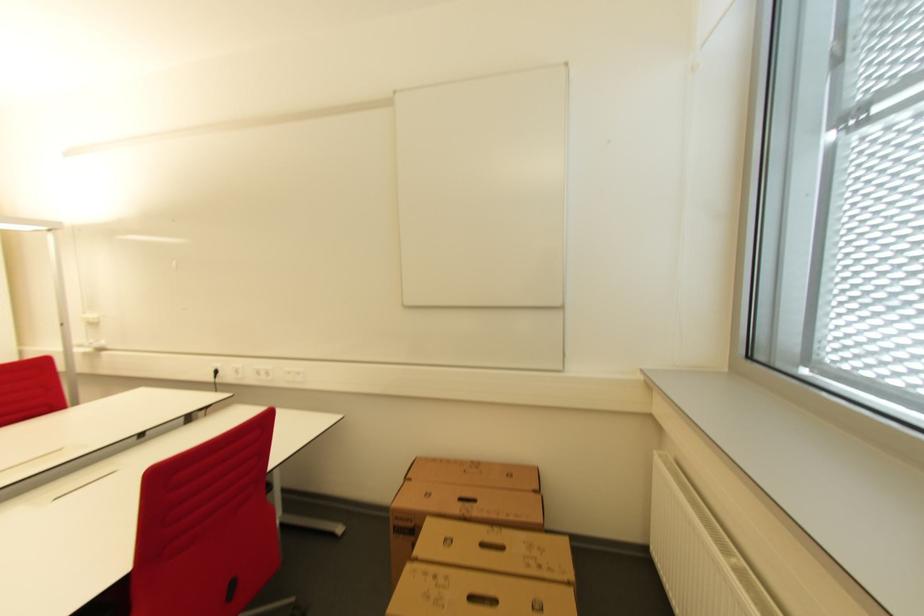
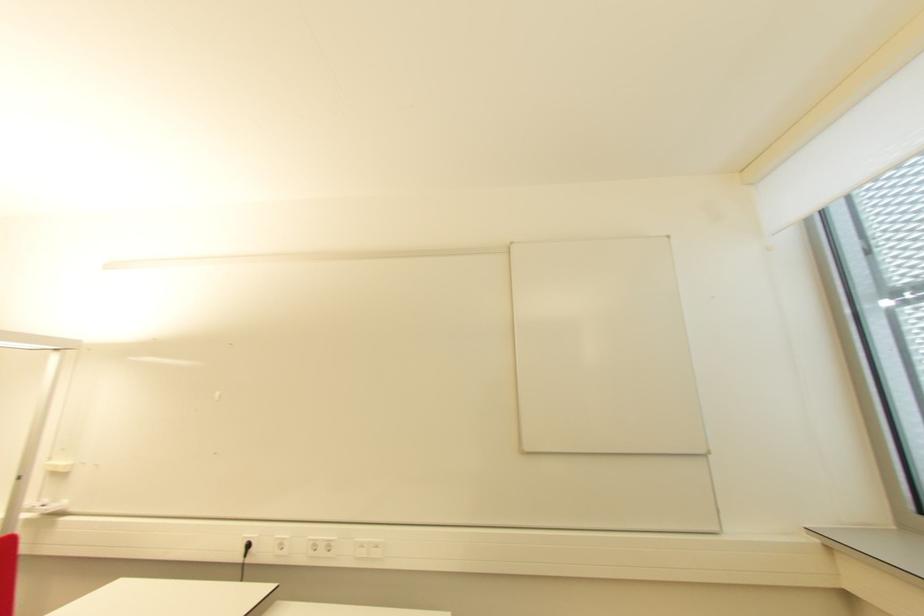
Question: The images are taken continuously from a first-person perspective. In which direction is your viewpoint rotating?

Choices:
 (A) Left
 (B) Right
 (C) Up
 (D) Down

Answer: (C)